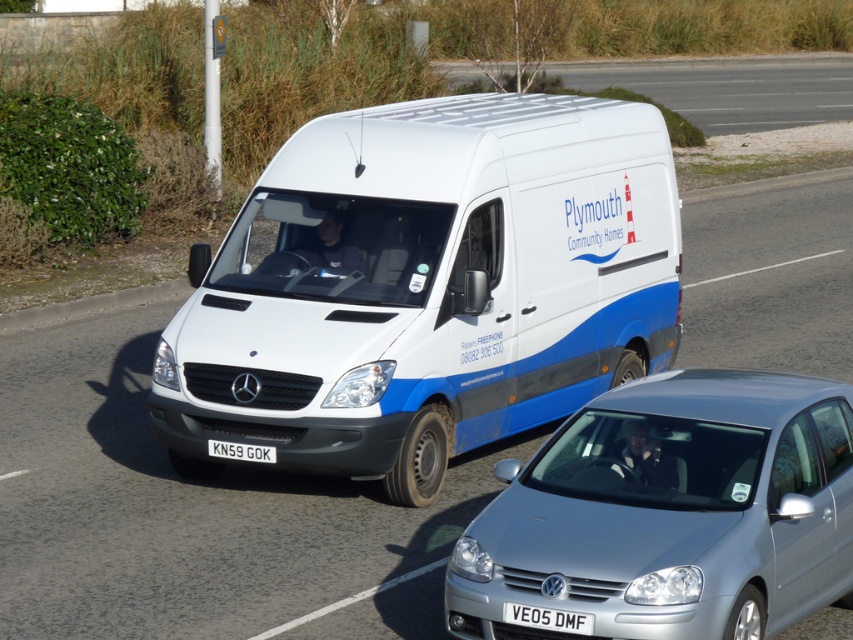
Does white matte van at center appear on the left side of black plastic license plate at center?

No, white matte van at center is not to the left of black plastic license plate at center.

Is white matte van at center positioned at the back of black plastic license plate at center?

No, white matte van at center is closer to the viewer.

Find the location of `white matte van at center`. white matte van at center is located at coordinates (426, 285).

Which is in front, point (560, 624) or point (236, 449)?

Positioned in front is point (560, 624).

Does point (519, 605) come in front of point (230, 445)?

Yes.

The image size is (853, 640). What do you see at coordinates (547, 618) in the screenshot?
I see `white plastic license plate at center` at bounding box center [547, 618].

Locate an element on the screen. Image resolution: width=853 pixels, height=640 pixels. white plastic license plate at center is located at coordinates (547, 618).

Does white matte van at center have a greater height compared to white plastic license plate at center?

Yes.

Is point (378, 467) behind point (583, 627)?

Yes.

What do you see at coordinates (426, 285) in the screenshot? I see `white matte van at center` at bounding box center [426, 285].

This screenshot has width=853, height=640. Identify the location of white matte van at center. (426, 285).